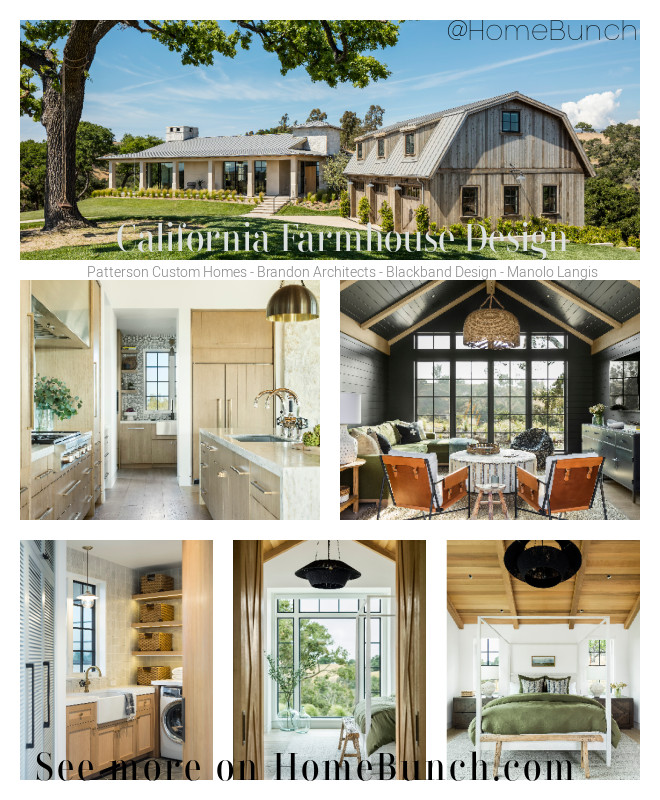
Image resolution: width=660 pixels, height=800 pixels. I want to click on washing machine, so click(x=171, y=741).